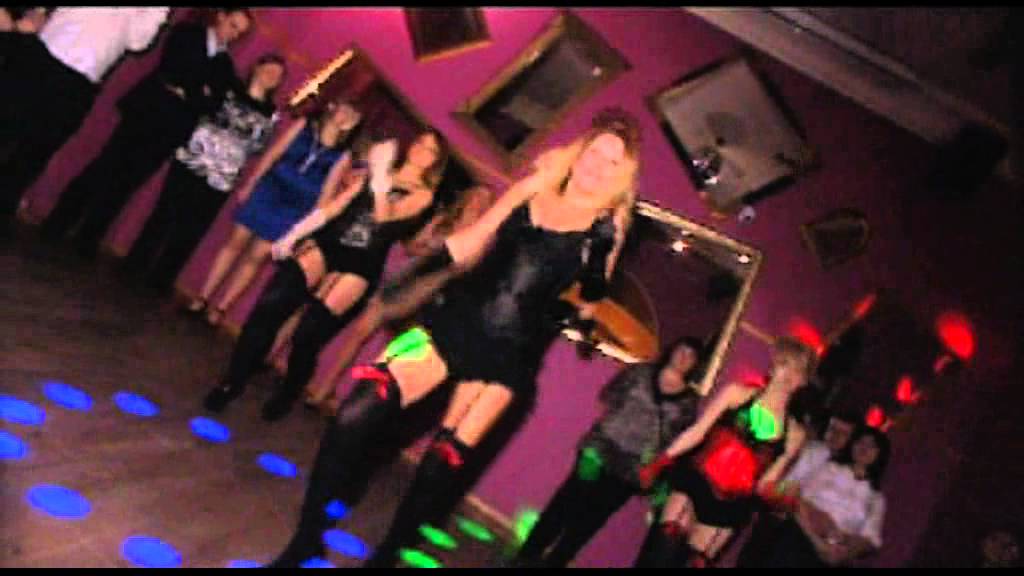
Identify the location of pictures. click(x=740, y=124), click(x=544, y=102), click(x=447, y=32), click(x=394, y=120), click(x=685, y=286), click(x=834, y=249).